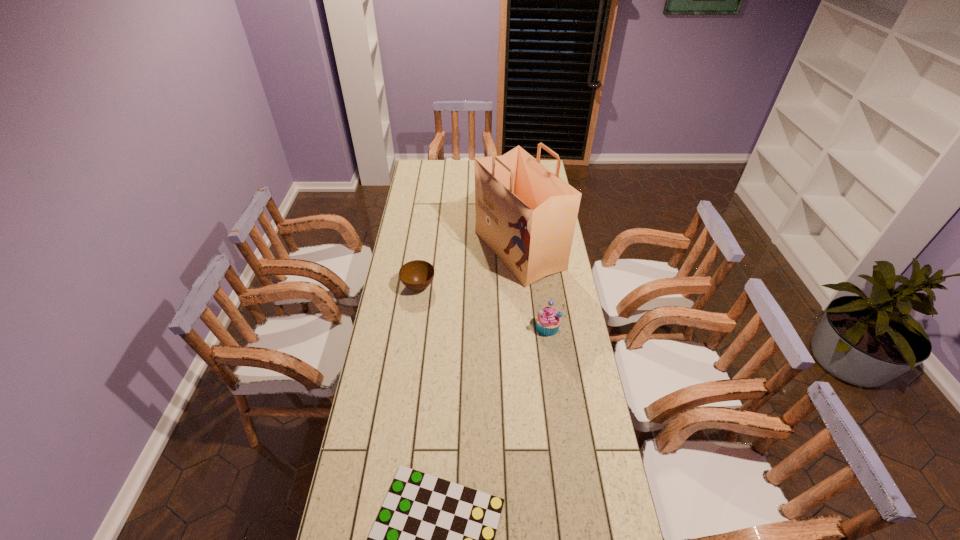
Identify the location of grocery bag at the right edge. (526, 214).

The width and height of the screenshot is (960, 540). Identify the location of muffin at the right edge. (548, 320).

Where is `vacant space at the far edge of the desktop`? The height and width of the screenshot is (540, 960). vacant space at the far edge of the desktop is located at coordinates (457, 161).

Find the location of `vacant space at the left edge of the desktop`. vacant space at the left edge of the desktop is located at coordinates (411, 191).

Image resolution: width=960 pixels, height=540 pixels. I want to click on vacant position at the right edge of the desktop, so click(x=619, y=512).

Find the location of a particular element. This screenshot has height=540, width=960. empty space between the bowl and the grocery bag is located at coordinates (468, 268).

Where is `free space between the tallest object and the third shortest object`? free space between the tallest object and the third shortest object is located at coordinates (533, 289).

Locate an element on the screen. This screenshot has height=540, width=960. empty location between the tallest object and the third farthest object is located at coordinates (533, 289).

Locate which object ranks in proximity to the muffin. Please provide its 2D coordinates. Your answer should be formatted as a tuple, i.e. [(x, y)], where the tuple contains the x and y coordinates of a point satisfying the conditions above.

[(526, 214)]

The image size is (960, 540). Find the location of `object identified as the third closest to the muffin`. object identified as the third closest to the muffin is located at coordinates (433, 539).